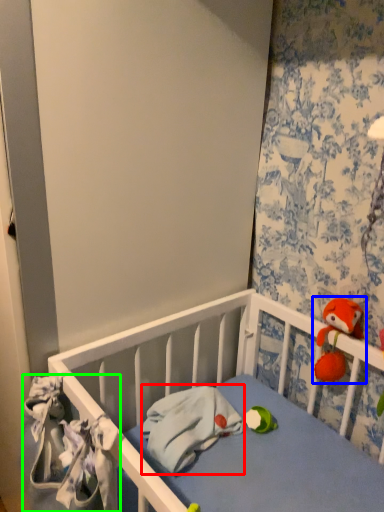
Question: Estimate the real-world distances between objects in this image. Which object is closer to material (highlighted by a red box), toy (highlighted by a blue box) or material (highlighted by a green box)?

Choices:
 (A) toy
 (B) material

Answer: (B)